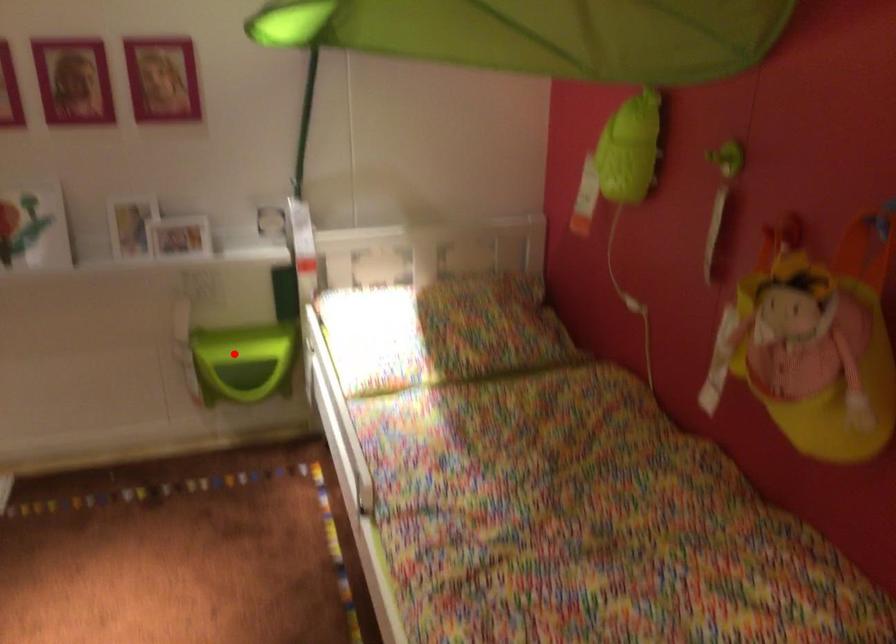
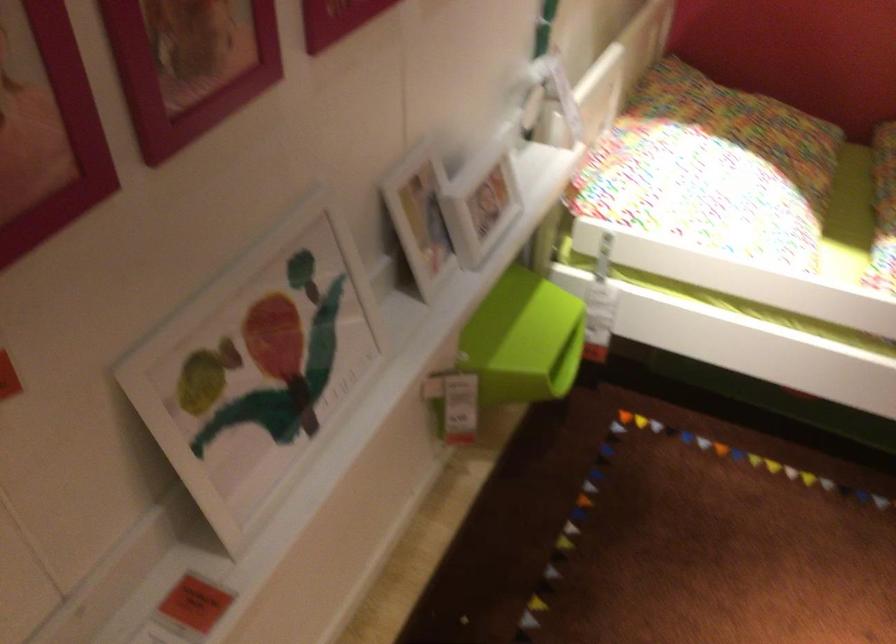
In the second image, find the point that corresponds to the highlighted location in the first image.

(522, 339)